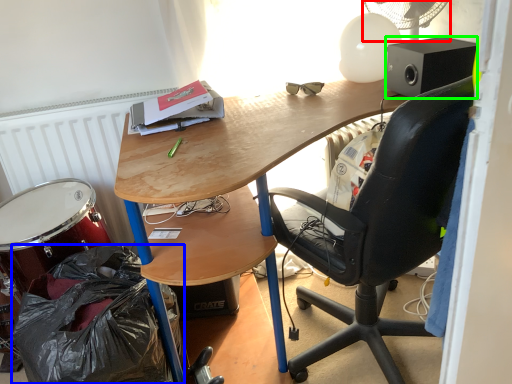
Question: Estimate the real-world distances between objects in this image. Which object is farther from mechanical fan (highlighted by a red box), garbage (highlighted by a blue box) or loudspeaker (highlighted by a green box)?

Choices:
 (A) garbage
 (B) loudspeaker

Answer: (A)